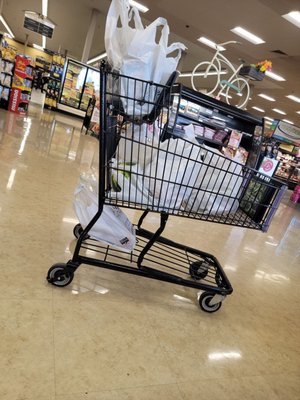
You are a GUI agent. You are given a task and a screenshot of the screen. Output one action in this format:
    pyautogui.click(x=<x>, y=<y>)
    Task: Click on the bottom rack
    The width and height of the screenshot is (300, 400).
    Given the screenshot: What is the action you would take?
    pyautogui.click(x=165, y=255)